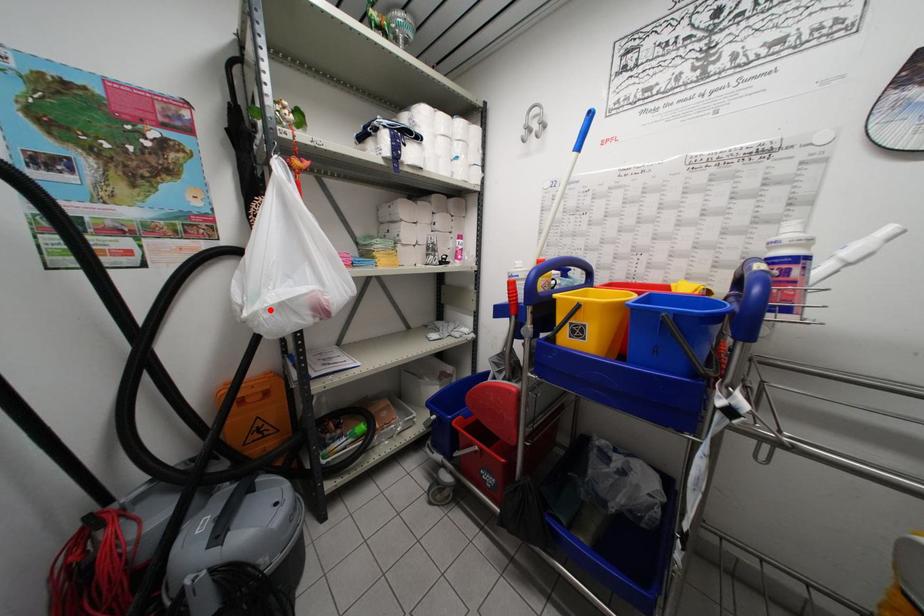
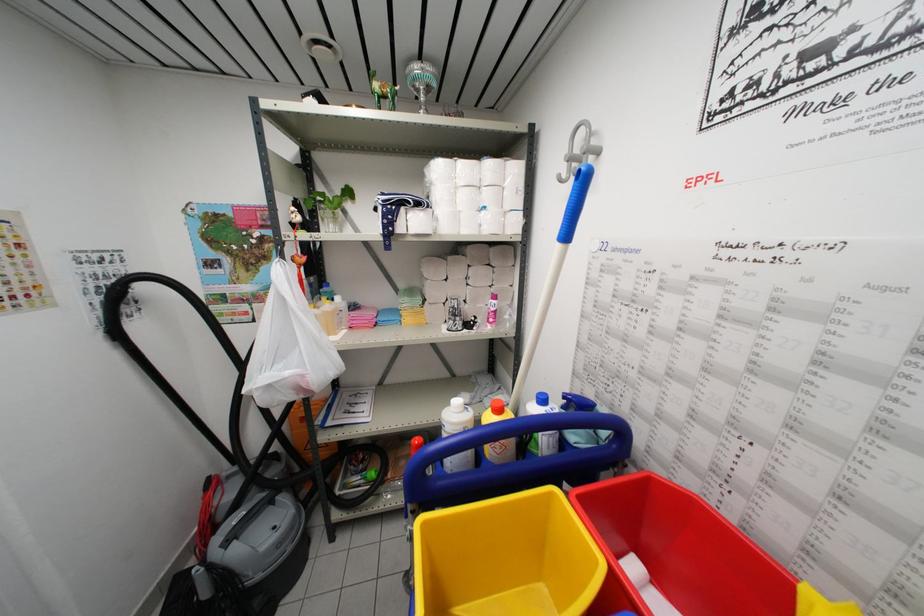
Locate, in the second image, the point that corresponds to the highlighted location in the first image.

(258, 392)